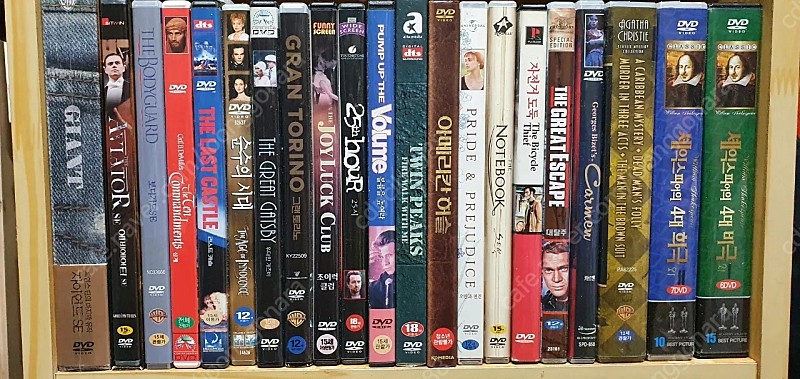
The image size is (800, 379). Find the location of `double dvd cases`. double dvd cases is located at coordinates (70, 214), (621, 213), (681, 209), (726, 203).